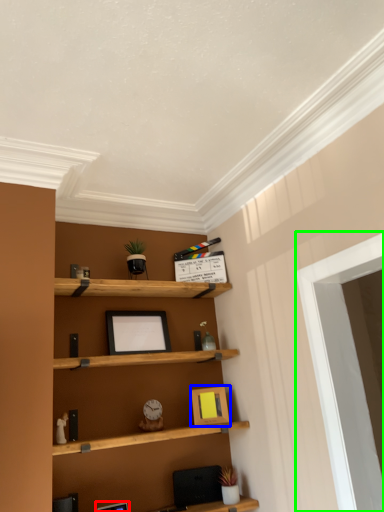
Question: Which object is the farthest from picture frame (highlighted by a red box)? Choose among these: picture frame (highlighted by a blue box) or window (highlighted by a green box).

Choices:
 (A) picture frame
 (B) window

Answer: (B)